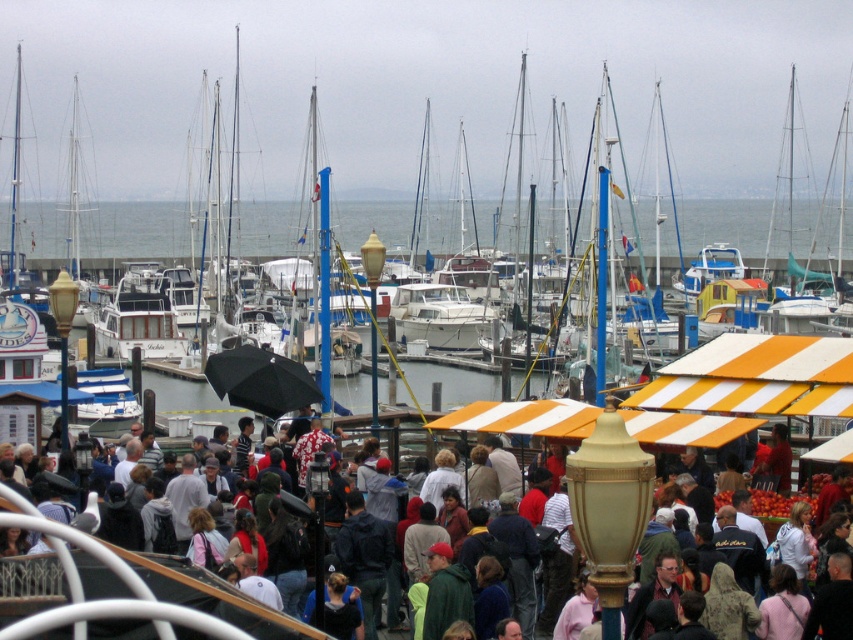
Question: Which point appears farthest from the camera in this image?

Choices:
 (A) (169, 170)
 (B) (154, 616)

Answer: (A)

Question: Does white glossy boat at center have a lesser width compared to multicolored fabric crowd at center?

Choices:
 (A) no
 (B) yes

Answer: (A)

Question: Is white glossy boat at center to the right of multicolored fabric crowd at center from the viewer's perspective?

Choices:
 (A) no
 (B) yes

Answer: (B)

Question: Does white glossy boat at center have a greater width compared to multicolored fabric crowd at center?

Choices:
 (A) no
 (B) yes

Answer: (B)

Question: Which point is farther from the camera taking this photo?

Choices:
 (A) (589, 198)
 (B) (611, 417)

Answer: (A)